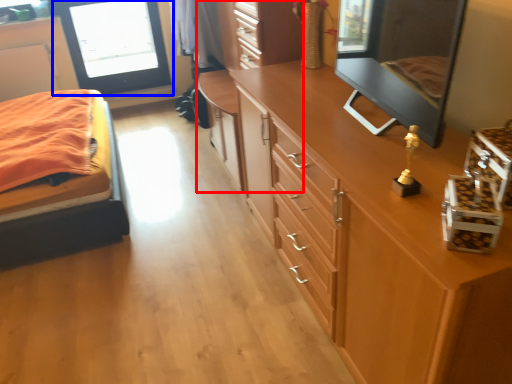
Question: Which object appears closest to the camera in this image, dresser (highlighted by a red box) or window screen (highlighted by a blue box)?

Choices:
 (A) dresser
 (B) window screen

Answer: (A)